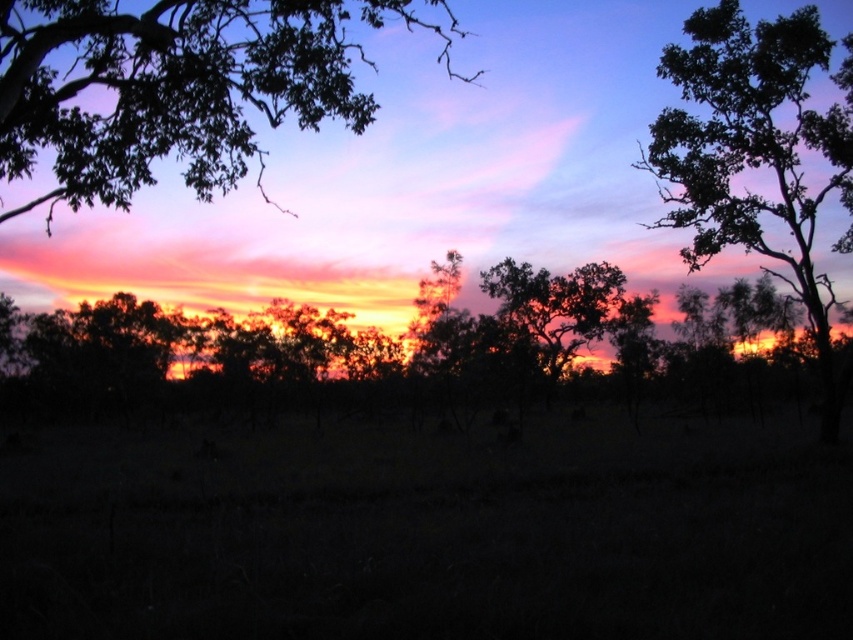
Question: Can you confirm if dark green leafy tree at upper left is positioned to the right of dark green leafy tree at upper right?

Choices:
 (A) yes
 (B) no

Answer: (B)

Question: Does dark green leafy tree at upper right have a larger size compared to silhouette leafy tree at center?

Choices:
 (A) yes
 (B) no

Answer: (A)

Question: Is silhouette tree at center wider than dark green leafy tree at upper left?

Choices:
 (A) yes
 (B) no

Answer: (A)

Question: Which of the following is the closest to the observer?

Choices:
 (A) (567, 326)
 (B) (212, 365)
 (C) (778, 180)

Answer: (B)

Question: Which point is closer to the camera?

Choices:
 (A) silhouette leafy tree at center
 (B) silhouette tree at center
 (C) dark green leafy tree at upper right
 (D) dark green leafy tree at upper left

Answer: (D)

Question: Which object is farther from the camera taking this photo?

Choices:
 (A) dark green leafy tree at upper left
 (B) silhouette tree at center
 (C) dark green leafy tree at upper right

Answer: (B)